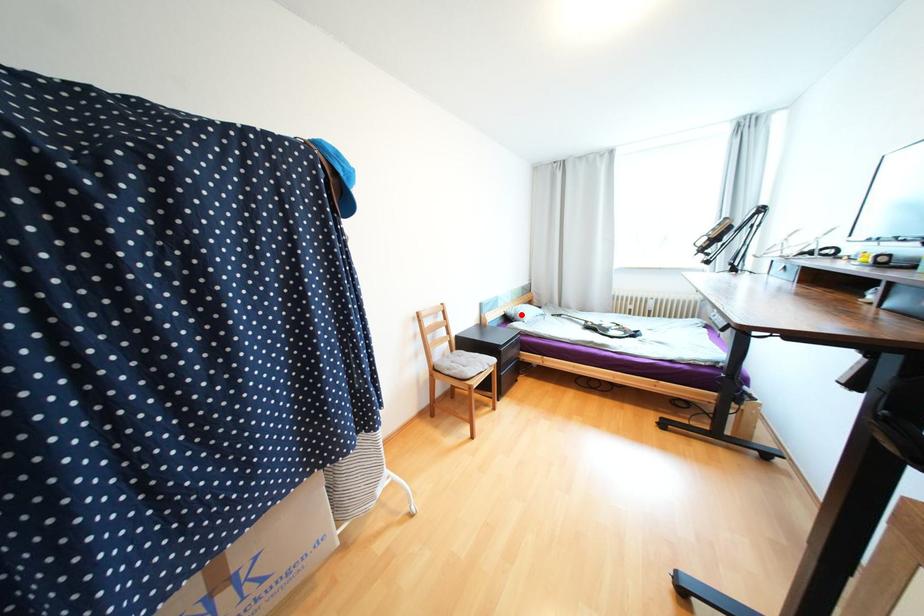
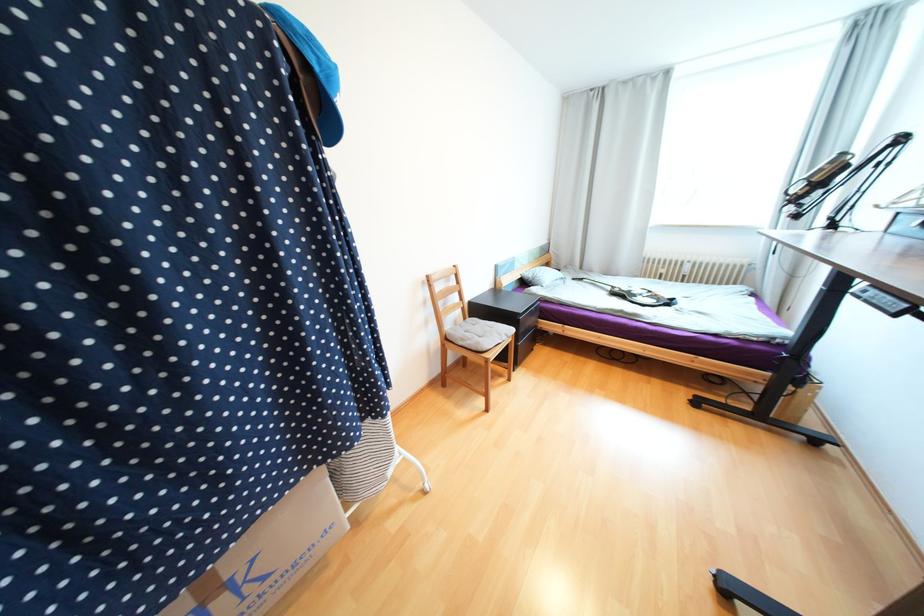
In the second image, find the point that corresponds to the highlighted location in the first image.

(540, 278)